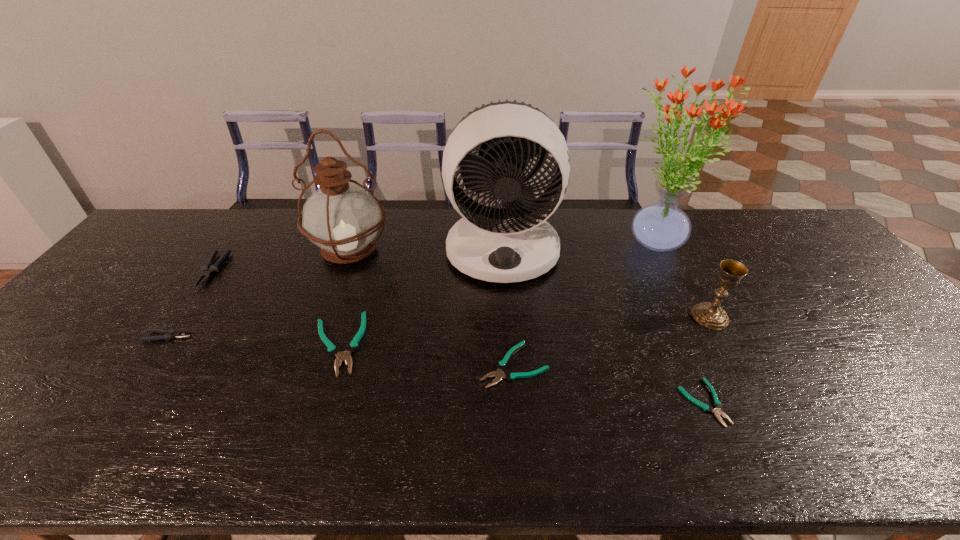
Where is `vacant space situated on the back of the third tallest pliers`? This screenshot has height=540, width=960. vacant space situated on the back of the third tallest pliers is located at coordinates (372, 235).

The width and height of the screenshot is (960, 540). In order to click on blank space located on the left of the fourth tallest pliers in this screenshot , I will do `click(455, 365)`.

This screenshot has width=960, height=540. In order to click on vacant space located 0.370m on the left of the shortest pliers in this screenshot , I will do `click(518, 402)`.

Where is `flower arrangement that is at the far edge`? flower arrangement that is at the far edge is located at coordinates click(x=662, y=226).

Image resolution: width=960 pixels, height=540 pixels. I want to click on fan that is at the far edge, so click(x=511, y=241).

The image size is (960, 540). I want to click on oil lamp present at the far edge, so click(x=343, y=219).

The image size is (960, 540). Identify the location of object present at the near edge. (717, 404).

Find the location of a particular element. This screenshot has width=960, height=540. vacant space at the far edge is located at coordinates (x=263, y=240).

I want to click on vacant space at the near edge, so click(915, 451).

Identify the location of free space at the right edge of the desktop. (867, 293).